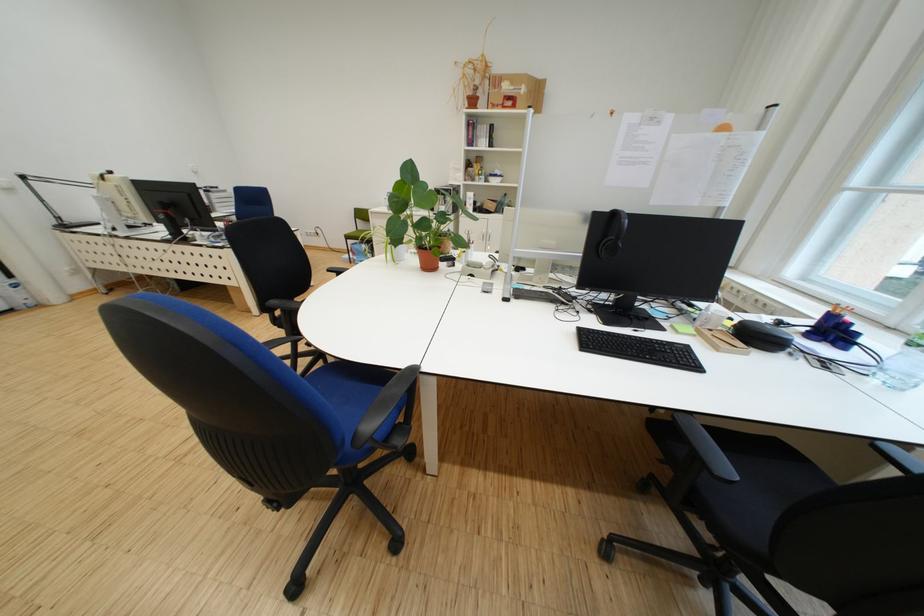
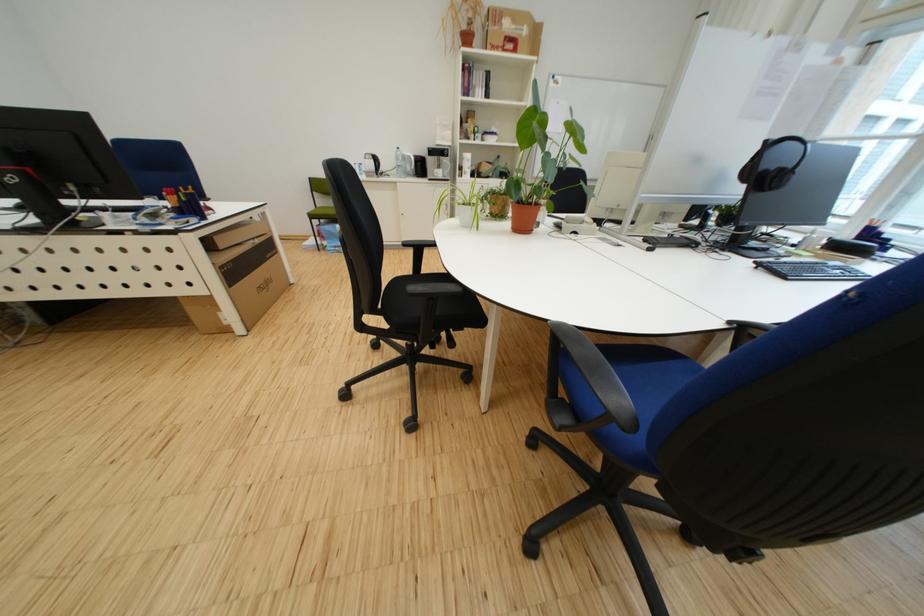
The point at (236, 288) is marked in the first image. Where is the corresponding point in the second image?

(186, 301)